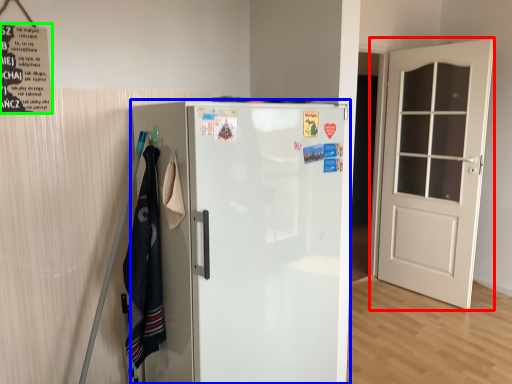
Question: Which object is positioned closest to door (highlighted by a red box)? Select from refrigerator (highlighted by a blue box) and poster (highlighted by a green box).

Choices:
 (A) refrigerator
 (B) poster

Answer: (A)